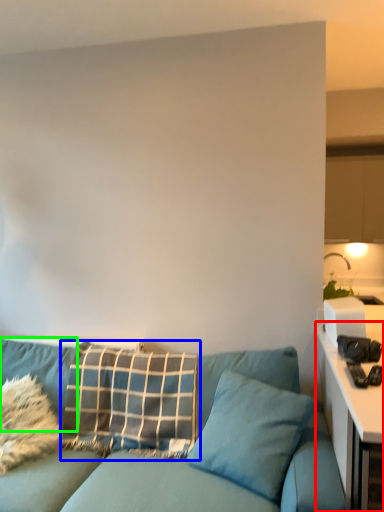
Question: Estimate the real-world distances between objects in this image. Which object is closer to table (highlighted by a red box), pillow (highlighted by a blue box) or pillow (highlighted by a green box)?

Choices:
 (A) pillow
 (B) pillow

Answer: (A)